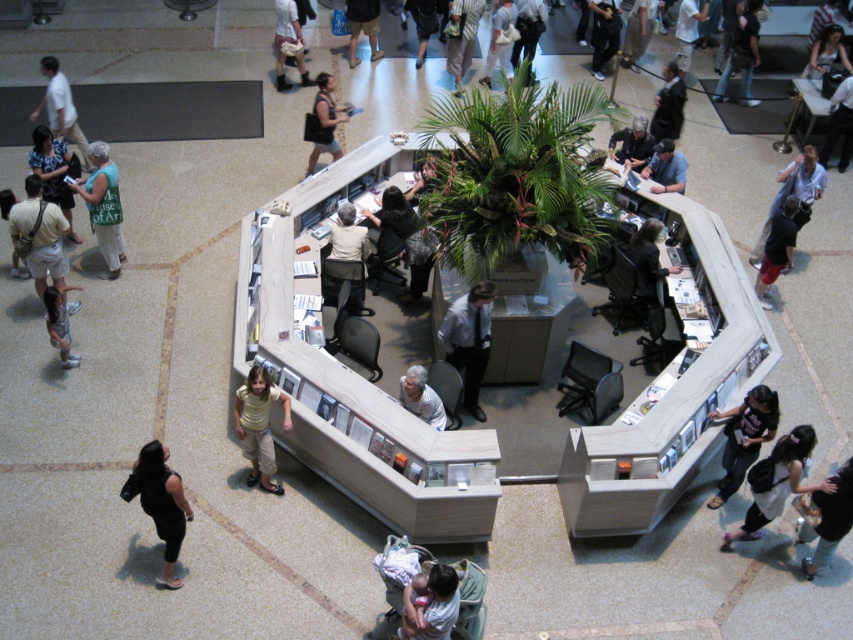
You are standing at the entrance of the museum and see the curved reception desk at the center. There is a point marked at coordinates (776,250) in the image. What object is located at that point?

The point at coordinates (776,250) corresponds to dark gray pants at lower right.

You are a photographer standing in the middle of the scene. You need to take a photo of both the matte white baby at center and the light blue jeans at center. Which object should you adjust your camera angle to focus on first if you want to capture both in the frame?

The matte white baby at center is positioned on the left side of light blue jeans at center, so you should focus on the matte white baby at center first to ensure both are in the frame.